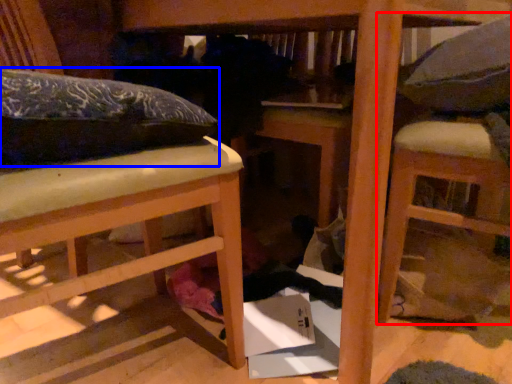
Question: Among these objects, which one is farthest to the camera, furniture (highlighted by a red box) or leftover (highlighted by a blue box)?

Choices:
 (A) furniture
 (B) leftover

Answer: (A)